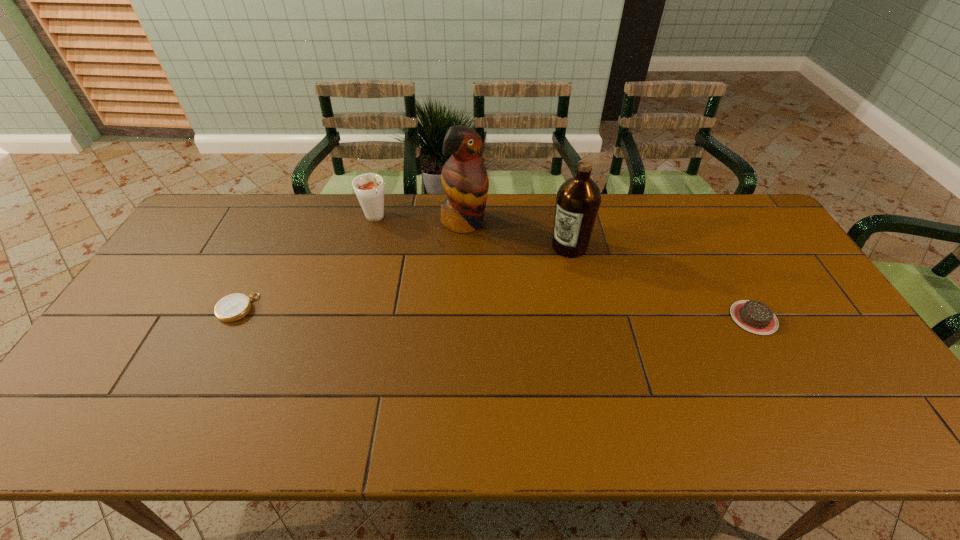
Locate an element on the screen. The height and width of the screenshot is (540, 960). the shortest object is located at coordinates (233, 307).

Locate an element on the screen. Image resolution: width=960 pixels, height=540 pixels. compass is located at coordinates (233, 307).

This screenshot has width=960, height=540. Find the location of `the rightmost object`. the rightmost object is located at coordinates (756, 317).

The width and height of the screenshot is (960, 540). I want to click on chocolate cake, so (x=756, y=317).

Identify the location of olive oil. The width and height of the screenshot is (960, 540). (578, 200).

You are a GUI agent. You are given a task and a screenshot of the screen. Output one action in this format:
    pyautogui.click(x=<x>, y=<y>)
    Task: Click on the fourth object from left to right
    The image size is (960, 540).
    Given the screenshot: What is the action you would take?
    pyautogui.click(x=578, y=200)

At what (x,y) coordinates should I click in order to perform the action: click on parrot. Please return your answer as a coordinate pair (x, y). This screenshot has width=960, height=540. Looking at the image, I should click on (464, 178).

At what (x,y) coordinates should I click in order to perform the action: click on the third object from right to left. Please return your answer as a coordinate pair (x, y). This screenshot has width=960, height=540. Looking at the image, I should click on (464, 178).

Where is `the third shortest object`? The height and width of the screenshot is (540, 960). the third shortest object is located at coordinates (369, 188).

Where is `the second object from left to right`? The height and width of the screenshot is (540, 960). the second object from left to right is located at coordinates (369, 188).